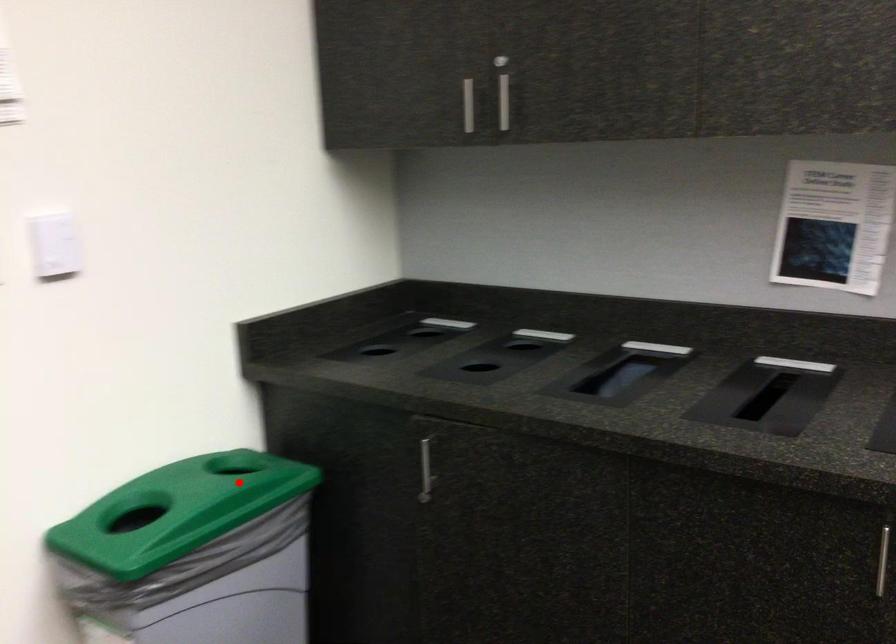
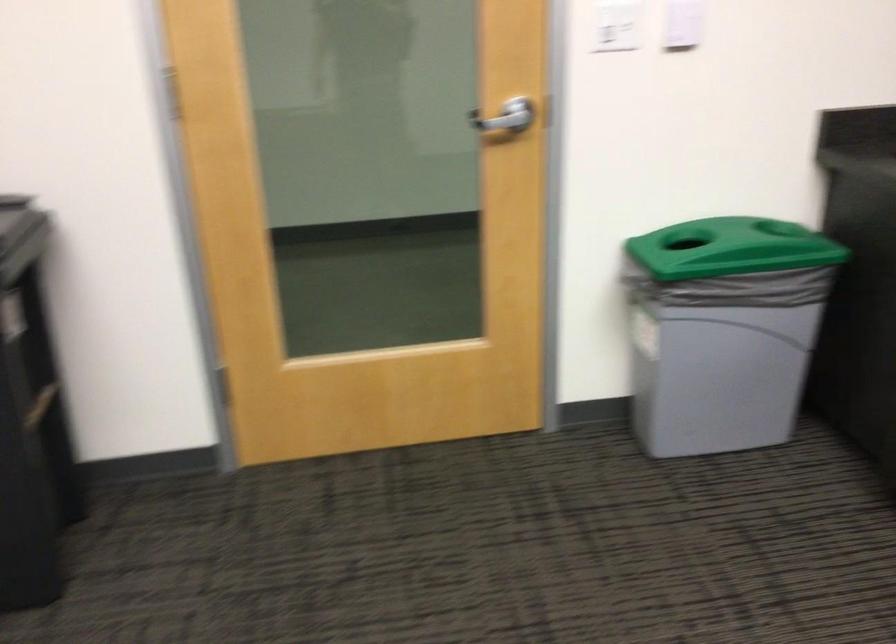
Question: I am providing you with two images of the same scene from different viewpoints. In image1, a red point is highlighted. Considering the same 3D point in image2, which of the following is correct?

Choices:
 (A) It is closer
 (B) It is farther

Answer: (B)